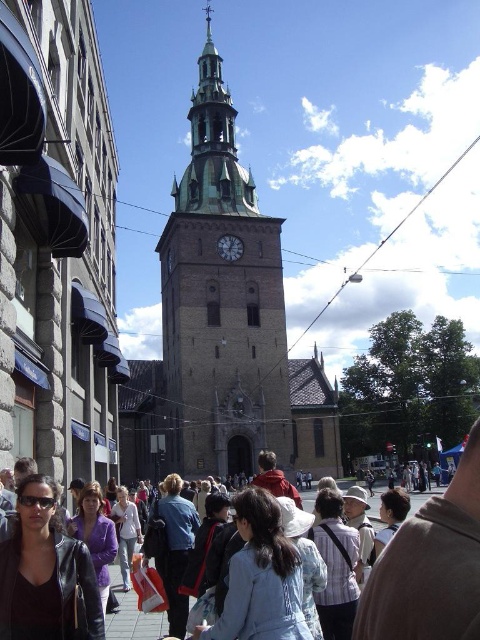
Question: Among these objects, which one is farthest from the camera?

Choices:
 (A) matte gray clock at center
 (B) brown stone church at center

Answer: (A)

Question: Does dark brown stone church at center appear under matte gray clock at center?

Choices:
 (A) yes
 (B) no

Answer: (A)

Question: Is matte black jacket at lower left smaller than matte gray clock at center?

Choices:
 (A) yes
 (B) no

Answer: (B)

Question: In this image, where is dark brown stone church at center located relative to matte black jacket at lower left?

Choices:
 (A) left
 (B) right

Answer: (A)

Question: Estimate the real-world distances between objects in this image. Which object is closer to the matte gray clock at center?

Choices:
 (A) matte black jacket at lower left
 (B) dark brown stone church at center

Answer: (B)

Question: Which object is closer to the camera taking this photo?

Choices:
 (A) matte black jacket at lower left
 (B) dark brown stone church at center
 (C) matte gray clock at center

Answer: (A)